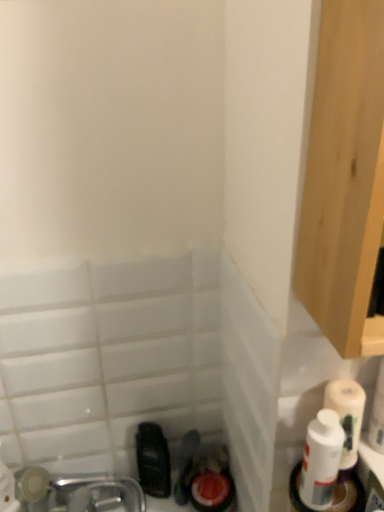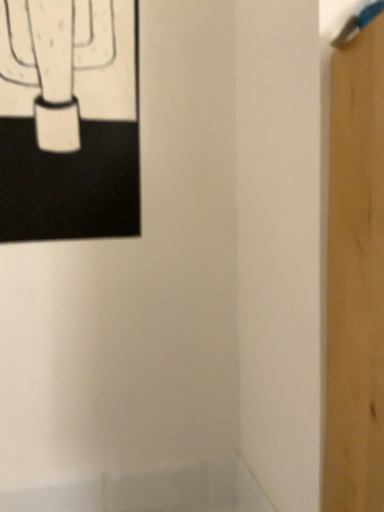
Question: How did the camera likely rotate when shooting the video?

Choices:
 (A) rotated upward
 (B) rotated downward

Answer: (A)